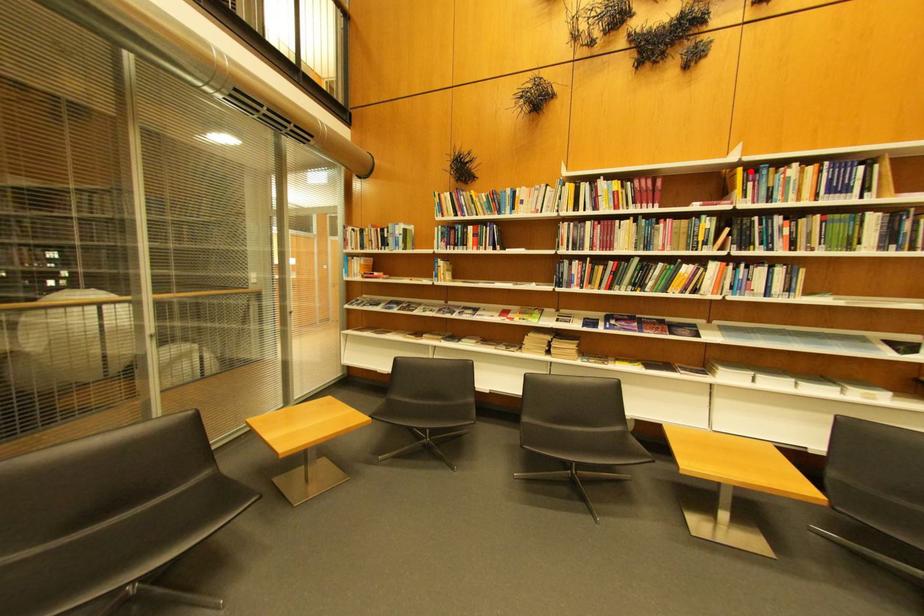
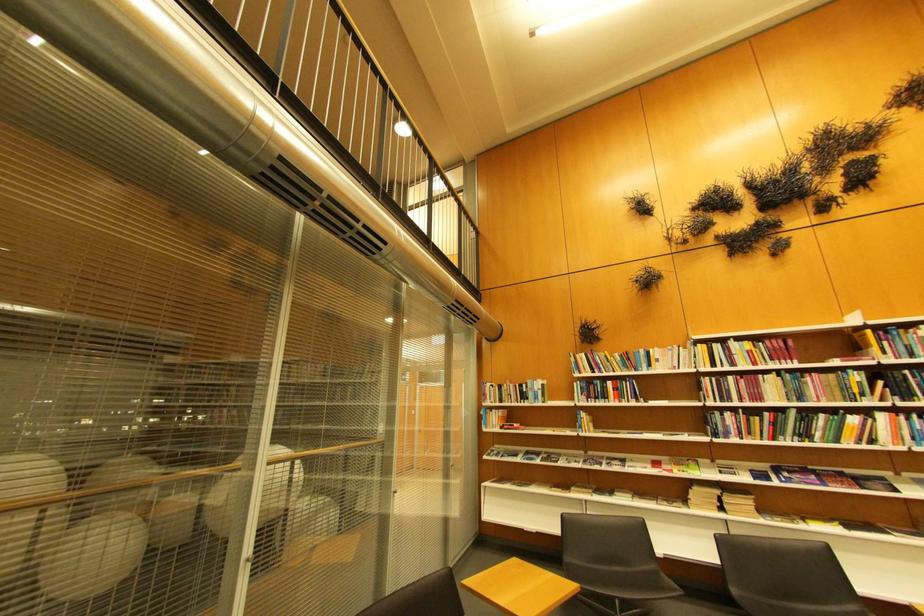
Find the pixel in the second image that matches the highlighted location in the first image.

(880, 333)